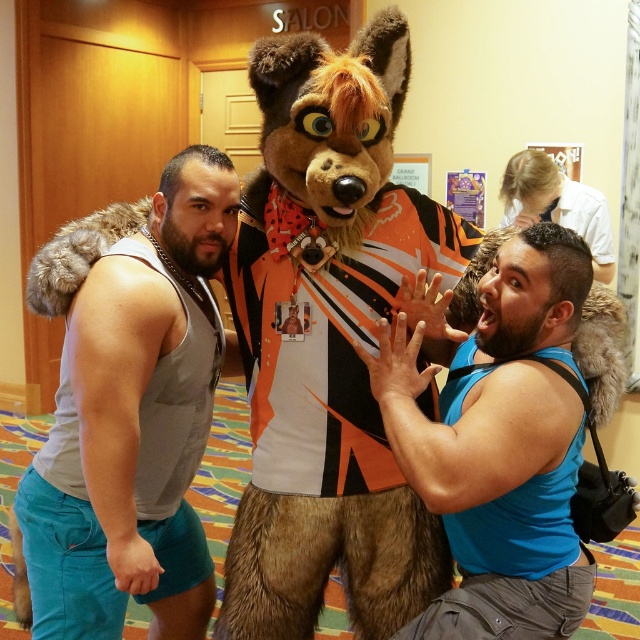
Who is taller, blue fabric shirt at center or gray fabric tank top at center?

gray fabric tank top at center is taller.

Is point (548, 467) positioned in front of point (161, 216)?

Yes, it is.

Where is `blue fabric shirt at center`? This screenshot has width=640, height=640. blue fabric shirt at center is located at coordinates (500, 445).